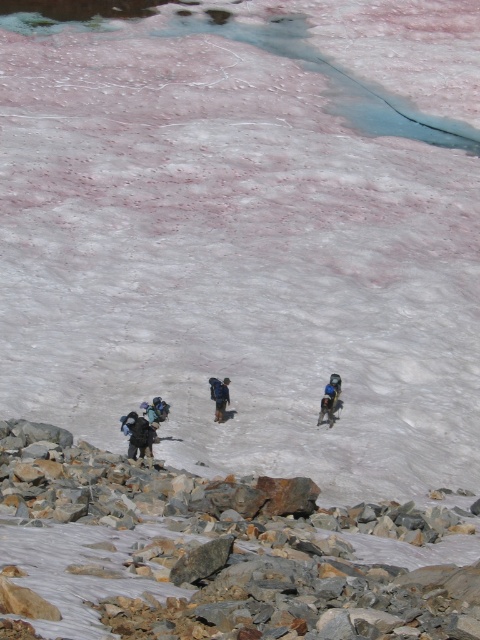
Is gray rock at lower left below blue fabric backpack at center-right?

Indeed, gray rock at lower left is positioned under blue fabric backpack at center-right.

Find the location of `gray rock at lower left`. gray rock at lower left is located at coordinates (215, 554).

Who is positioned more to the left, gray rock at lower left or dark blue backpack at center?

Positioned to the left is dark blue backpack at center.

Is gray rock at lower left closer to camera compared to dark blue backpack at center?

Yes, gray rock at lower left is closer to the viewer.

Find the location of a particular element. The width and height of the screenshot is (480, 640). gray rock at lower left is located at coordinates (215, 554).

Is blue fabric backpack at center-right positioned before dark blue backpack at center?

No, it is not.

Is blue fabric backpack at center-right above dark blue backpack at center?

Correct, blue fabric backpack at center-right is located above dark blue backpack at center.

Does point (324, 397) come in front of point (217, 410)?

Yes, point (324, 397) is in front of point (217, 410).

Identify the location of blue fabric backpack at center-right. (330, 400).